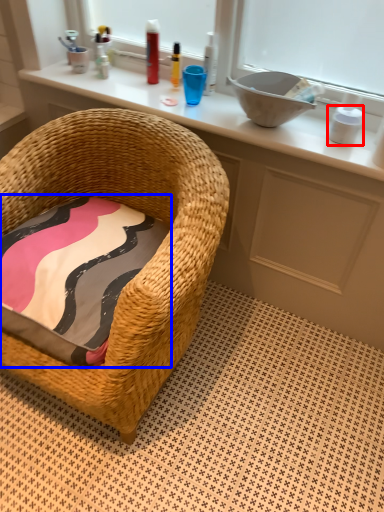
Question: Which object is further to the camera taking this photo, toiletry (highlighted by a red box) or pillow (highlighted by a blue box)?

Choices:
 (A) toiletry
 (B) pillow

Answer: (A)